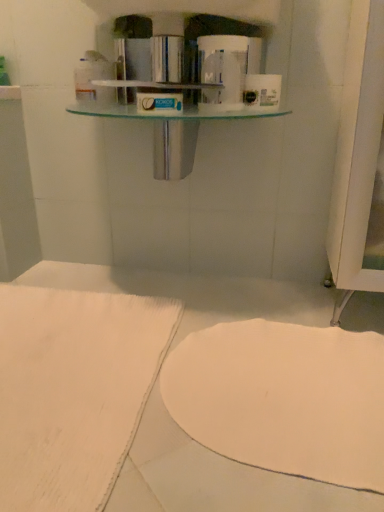
Find the location of a particular element. white glossy toilet paper at upper center, placed as the 1th toilet paper when sorted from left to right is located at coordinates (222, 71).

Measure the distance between white matte towel at lower center and camera.

They are 23.46 inches apart.

This screenshot has width=384, height=512. Identify the location of white matte toilet paper at upper center, the 2th toilet paper in the left-to-right sequence. (262, 90).

The image size is (384, 512). What are the coordinates of `white glossy toilet paper at upper center, which is the second toilet paper from right to left` in the screenshot? It's located at (222, 71).

How many degrees apart are the facing directions of white matte toilet paper at upper center, the 1th toilet paper from the right, and white matte towel at lower center?

0.308 degrees separate the facing orientations of white matte toilet paper at upper center, the 1th toilet paper from the right, and white matte towel at lower center.

Does white matte toilet paper at upper center, the 1th toilet paper from the right, touch white matte towel at lower center?

No, white matte toilet paper at upper center, the 1th toilet paper from the right, is not next to white matte towel at lower center.

Is point (273, 105) positioned behind point (289, 412)?

Yes, it is.

Where is `wide that is under the white matte toilet paper at upper center, the 2th toilet paper in the left-to-right sequence (from a real-world perspective)`? wide that is under the white matte toilet paper at upper center, the 2th toilet paper in the left-to-right sequence (from a real-world perspective) is located at coordinates (283, 398).

Find the location of a particular element. toilet paper on the left of white matte toilet paper at upper center, the 1th toilet paper from the right is located at coordinates [x=222, y=71].

Considering the sizes of objects white matte toilet paper at upper center, the 2th toilet paper in the left-to-right sequence, and white glossy toilet paper at upper center, which is the second toilet paper from right to left, in the image provided, who is smaller, white matte toilet paper at upper center, the 2th toilet paper in the left-to-right sequence, or white glossy toilet paper at upper center, which is the second toilet paper from right to left,?

white matte toilet paper at upper center, the 2th toilet paper in the left-to-right sequence, is smaller.

Is white glossy toilet paper at upper center, placed as the 1th toilet paper when sorted from left to right, surrounded by white matte toilet paper at upper center, the 2th toilet paper in the left-to-right sequence?

No, white matte toilet paper at upper center, the 2th toilet paper in the left-to-right sequence, does not contain white glossy toilet paper at upper center, placed as the 1th toilet paper when sorted from left to right.

Can you confirm if white matte toilet paper at upper center, the 2th toilet paper in the left-to-right sequence, is positioned to the right of white glossy toilet paper at upper center, which is the second toilet paper from right to left?

Indeed, white matte toilet paper at upper center, the 2th toilet paper in the left-to-right sequence, is positioned on the right side of white glossy toilet paper at upper center, which is the second toilet paper from right to left.

From the image's perspective, is white matte towel at lower center located beneath white matte toilet paper at upper center, the 2th toilet paper in the left-to-right sequence?

Yes, from the image's perspective, white matte towel at lower center is beneath white matte toilet paper at upper center, the 2th toilet paper in the left-to-right sequence.

Is white matte towel at lower center positioned beyond the bounds of white matte toilet paper at upper center, the 2th toilet paper in the left-to-right sequence?

Yes, white matte towel at lower center is located beyond the bounds of white matte toilet paper at upper center, the 2th toilet paper in the left-to-right sequence.

Which object is wider, white matte towel at lower center or white matte toilet paper at upper center, the 2th toilet paper in the left-to-right sequence?

With larger width is white matte towel at lower center.

Is point (164, 365) in front of point (246, 79)?

Yes, it is.

Which object is closer to the camera, white fabric at lower left or white matte toilet paper at upper center, the 1th toilet paper from the right?

white fabric at lower left is more forward.

Which of these two, white fabric at lower left or white matte toilet paper at upper center, the 2th toilet paper in the left-to-right sequence, is wider?

With larger width is white fabric at lower left.

Can you confirm if white fabric at lower left is smaller than white matte toilet paper at upper center, the 2th toilet paper in the left-to-right sequence?

Incorrect, white fabric at lower left is not smaller in size than white matte toilet paper at upper center, the 2th toilet paper in the left-to-right sequence.

Does point (135, 358) come farther from viewer compared to point (272, 96)?

No, (135, 358) is in front of (272, 96).

Considering the sizes of white matte towel at lower center and white glossy toilet paper at upper center, placed as the 1th toilet paper when sorted from left to right, in the image, is white matte towel at lower center taller or shorter than white glossy toilet paper at upper center, placed as the 1th toilet paper when sorted from left to right,?

white matte towel at lower center is shorter than white glossy toilet paper at upper center, placed as the 1th toilet paper when sorted from left to right.

Looking at this image, would you say white glossy toilet paper at upper center, which is the second toilet paper from right to left, is part of white matte towel at lower center's contents?

No, white glossy toilet paper at upper center, which is the second toilet paper from right to left, is located outside of white matte towel at lower center.

From a real-world perspective, is white matte towel at lower center under white glossy toilet paper at upper center, placed as the 1th toilet paper when sorted from left to right?

Yes.

Is white glossy toilet paper at upper center, placed as the 1th toilet paper when sorted from left to right, far away from white fabric at lower left?

No, white glossy toilet paper at upper center, placed as the 1th toilet paper when sorted from left to right, is not far away from white fabric at lower left.

Is the position of white glossy toilet paper at upper center, placed as the 1th toilet paper when sorted from left to right, less distant than that of white fabric at lower left?

No.

Does white glossy toilet paper at upper center, which is the second toilet paper from right to left, contain white fabric at lower left?

No, white fabric at lower left is not a part of white glossy toilet paper at upper center, which is the second toilet paper from right to left.

From a real-world perspective, is white matte toilet paper at upper center, the 2th toilet paper in the left-to-right sequence, located higher than white fabric at lower left?

Yes.

Would you say white matte toilet paper at upper center, the 2th toilet paper in the left-to-right sequence, is outside white fabric at lower left?

white matte toilet paper at upper center, the 2th toilet paper in the left-to-right sequence, is positioned outside white fabric at lower left.

From the image's perspective, which toilet paper is the 1st one above the white fabric at lower left? Please provide its 2D coordinates.

[(262, 90)]

Locate an element on the screen. Image resolution: width=384 pixels, height=512 pixels. wide located in front of the white matte toilet paper at upper center, the 2th toilet paper in the left-to-right sequence is located at coordinates (283, 398).

This screenshot has height=512, width=384. In order to click on toilet paper above the white matte toilet paper at upper center, the 1th toilet paper from the right (from a real-world perspective) in this screenshot , I will do `click(222, 71)`.

Which object lies nearer to the anchor point white fabric at lower left, white glossy toilet paper at upper center, placed as the 1th toilet paper when sorted from left to right, or white matte toilet paper at upper center, the 1th toilet paper from the right?

Among the two, white glossy toilet paper at upper center, placed as the 1th toilet paper when sorted from left to right, is located nearer to white fabric at lower left.

When comparing their distances from white glossy toilet paper at upper center, placed as the 1th toilet paper when sorted from left to right, does white matte towel at lower center or white fabric at lower left seem further?

white fabric at lower left is further to white glossy toilet paper at upper center, placed as the 1th toilet paper when sorted from left to right.

Estimate the real-world distances between objects in this image. Which object is closer to white fabric at lower left, white glossy toilet paper at upper center, which is the second toilet paper from right to left, or white matte towel at lower center?

Among the two, white matte towel at lower center is located nearer to white fabric at lower left.

When comparing their distances from white glossy toilet paper at upper center, placed as the 1th toilet paper when sorted from left to right, does white matte toilet paper at upper center, the 2th toilet paper in the left-to-right sequence, or white fabric at lower left seem further?

white fabric at lower left lies further to white glossy toilet paper at upper center, placed as the 1th toilet paper when sorted from left to right, than the other object.

From the image, which object appears to be nearer to white matte toilet paper at upper center, the 1th toilet paper from the right, white fabric at lower left or white glossy toilet paper at upper center, which is the second toilet paper from right to left?

Among the two, white glossy toilet paper at upper center, which is the second toilet paper from right to left, is located nearer to white matte toilet paper at upper center, the 1th toilet paper from the right.

From the image, which object appears to be nearer to white matte towel at lower center, white glossy toilet paper at upper center, which is the second toilet paper from right to left, or white matte toilet paper at upper center, the 2th toilet paper in the left-to-right sequence?

white glossy toilet paper at upper center, which is the second toilet paper from right to left, lies closer to white matte towel at lower center than the other object.

When comparing their distances from white matte toilet paper at upper center, the 2th toilet paper in the left-to-right sequence, does white matte towel at lower center or white fabric at lower left seem closer?

Among the two, white matte towel at lower center is located nearer to white matte toilet paper at upper center, the 2th toilet paper in the left-to-right sequence.

Looking at the image, which one is located further to white matte towel at lower center, white glossy toilet paper at upper center, which is the second toilet paper from right to left, or white fabric at lower left?

The object further to white matte towel at lower center is white glossy toilet paper at upper center, which is the second toilet paper from right to left.

Image resolution: width=384 pixels, height=512 pixels. I want to click on sheet between white matte toilet paper at upper center, the 1th toilet paper from the right, and white matte towel at lower center vertically, so click(x=74, y=391).

Locate an element on the screen. The height and width of the screenshot is (512, 384). sheet between white glossy toilet paper at upper center, placed as the 1th toilet paper when sorted from left to right, and white matte towel at lower center, in the vertical direction is located at coordinates (74, 391).

Where is `toilet paper between white glossy toilet paper at upper center, which is the second toilet paper from right to left, and white fabric at lower left in the up-down direction`? The width and height of the screenshot is (384, 512). toilet paper between white glossy toilet paper at upper center, which is the second toilet paper from right to left, and white fabric at lower left in the up-down direction is located at coordinates (262, 90).

Locate an element on the screen. toilet paper between white glossy toilet paper at upper center, which is the second toilet paper from right to left, and white matte towel at lower center, in the vertical direction is located at coordinates (262, 90).